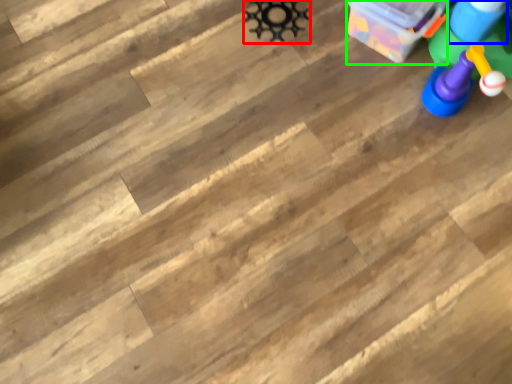
Question: Which object is positioned farthest from toy (highlighted by a red box)? Select from toy (highlighted by a blue box) and cardboard box (highlighted by a green box).

Choices:
 (A) toy
 (B) cardboard box

Answer: (A)